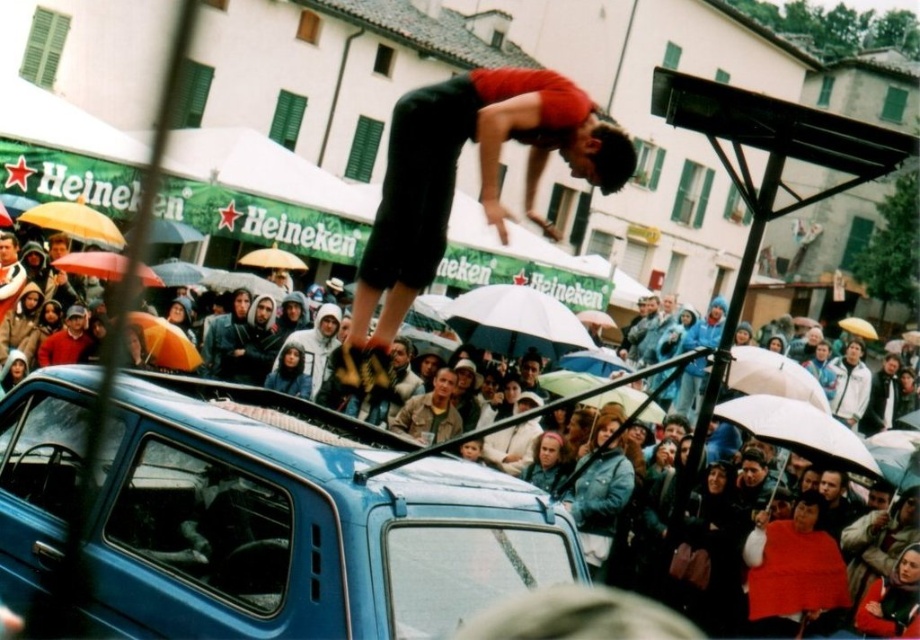
Question: Is blue matte car at center positioned in front of white matte umbrella at center?

Choices:
 (A) no
 (B) yes

Answer: (B)

Question: Which point is closer to the camera taking this photo?

Choices:
 (A) (130, 438)
 (B) (483, 333)

Answer: (A)

Question: Can you confirm if blue matte car at center is positioned to the right of matte black jacket at center?

Choices:
 (A) yes
 (B) no

Answer: (B)

Question: Which point is closer to the camera taking this photo?

Choices:
 (A) (175, 614)
 (B) (475, 314)

Answer: (A)

Question: Can you confirm if blue matte car at center is positioned below white matte umbrella at center?

Choices:
 (A) yes
 (B) no

Answer: (A)

Question: Which point is farther from the camera taking this photo?

Choices:
 (A) (504, 312)
 (B) (29, 564)
 (C) (24, 456)

Answer: (A)